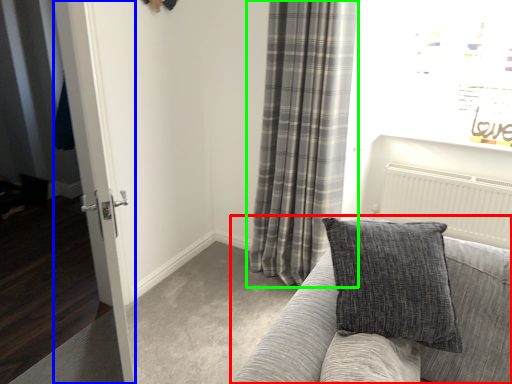
Question: Considering the real-world distances, which object is farthest from studio couch (highlighted by a red box)? glass door (highlighted by a blue box) or curtain (highlighted by a green box)?

Choices:
 (A) glass door
 (B) curtain

Answer: (B)